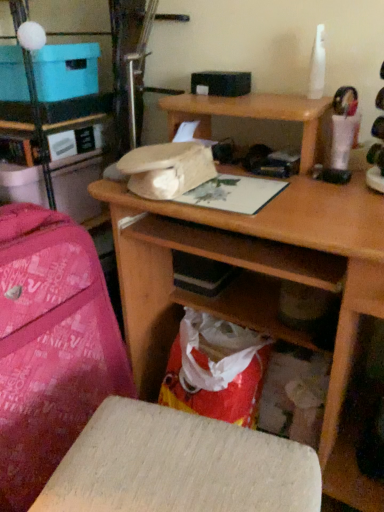
Question: Is pink fabric bag at left to the left of wooden desk at center from the viewer's perspective?

Choices:
 (A) yes
 (B) no

Answer: (A)

Question: Is pink fabric bag at left located outside wooden desk at center?

Choices:
 (A) yes
 (B) no

Answer: (A)

Question: Is pink fabric bag at left bigger than wooden desk at center?

Choices:
 (A) yes
 (B) no

Answer: (B)

Question: From a real-world perspective, is pink fabric bag at left physically below wooden desk at center?

Choices:
 (A) no
 (B) yes

Answer: (A)

Question: Can you confirm if pink fabric bag at left is wider than wooden desk at center?

Choices:
 (A) yes
 (B) no

Answer: (B)

Question: In the image, is pink fabric suitcase at left positioned in front of or behind pink fabric bag at left?

Choices:
 (A) behind
 (B) front

Answer: (B)

Question: Is point (24, 265) positioned closer to the camera than point (96, 115)?

Choices:
 (A) farther
 (B) closer

Answer: (B)

Question: From the image's perspective, is pink fabric suitcase at left above or below pink fabric bag at left?

Choices:
 (A) above
 (B) below

Answer: (B)

Question: From a real-world perspective, is pink fabric suitcase at left physically located above or below pink fabric bag at left?

Choices:
 (A) below
 (B) above

Answer: (A)

Question: Considering the positions of pink fabric bag at left and wooden stool at lower center in the image, is pink fabric bag at left bigger or smaller than wooden stool at lower center?

Choices:
 (A) big
 (B) small

Answer: (B)

Question: Is pink fabric bag at left in front of or behind wooden stool at lower center in the image?

Choices:
 (A) front
 (B) behind

Answer: (B)

Question: From a real-world perspective, is pink fabric bag at left positioned above or below wooden stool at lower center?

Choices:
 (A) below
 (B) above

Answer: (B)

Question: Looking at their shapes, would you say pink fabric bag at left is wider or thinner than wooden stool at lower center?

Choices:
 (A) thin
 (B) wide

Answer: (B)

Question: Is point (44, 91) closer or farther from the camera than point (228, 423)?

Choices:
 (A) closer
 (B) farther

Answer: (B)

Question: In the image, is blue cardboard box at upper left positioned in front of or behind wooden stool at lower center?

Choices:
 (A) behind
 (B) front

Answer: (A)